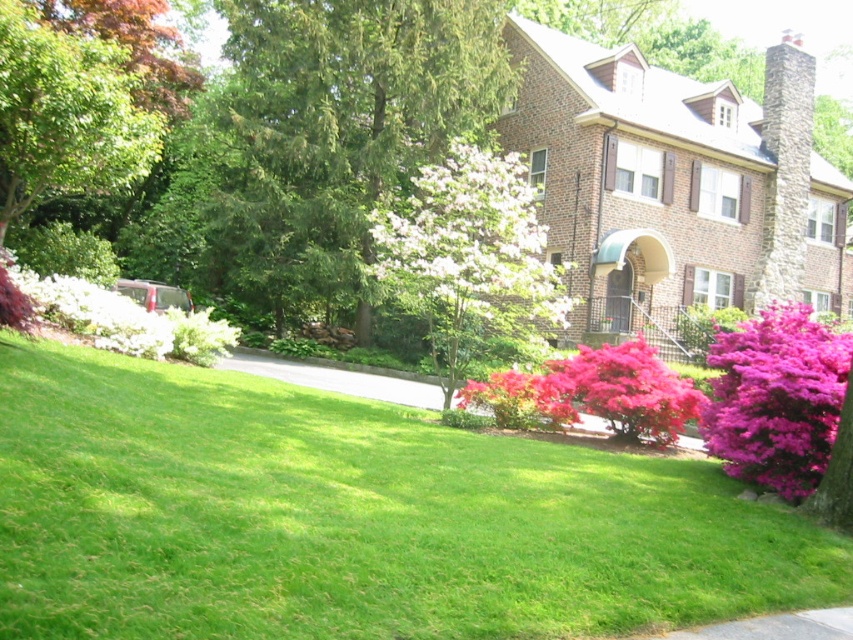
Who is more distant from viewer, (355, 292) or (566, 308)?

The point (355, 292) is behind.

Is green textured tree at upper center closer to camera compared to white matte flower at center?

No.

This screenshot has width=853, height=640. In order to click on green textured tree at upper center in this screenshot , I will do `click(347, 125)`.

You are a GUI agent. You are given a task and a screenshot of the screen. Output one action in this format:
    pyautogui.click(x=<x>, y=<y>)
    Task: Click on the green textured tree at upper center
    Image resolution: width=853 pixels, height=640 pixels.
    Given the screenshot: What is the action you would take?
    347,125

Does white matte flower at center have a greater width compared to gray asphalt pavement at center?

Incorrect, white matte flower at center's width does not surpass gray asphalt pavement at center's.

Which is behind, point (460, 152) or point (247, 362)?

The point (247, 362) is more distant.

In order to click on white matte flower at center in this screenshot , I will do `click(469, 244)`.

Is point (515, 268) positioned before point (753, 452)?

No, it is not.

Can you confirm if white matte flower at center is wider than purple velvet bush at lower right?

No, white matte flower at center is not wider than purple velvet bush at lower right.

Find the location of a particular element. white matte flower at center is located at coordinates (469, 244).